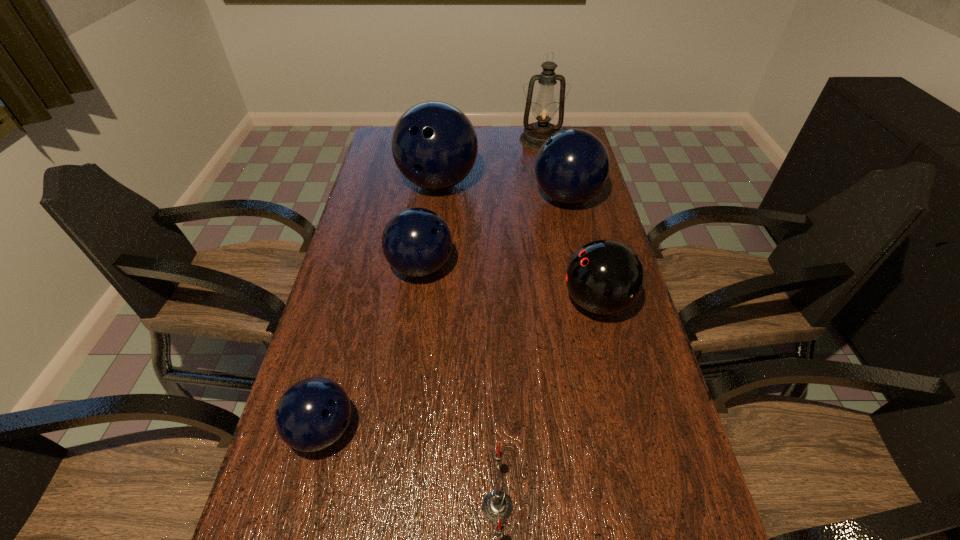
You are a GUI agent. You are given a task and a screenshot of the screen. Output one action in this format:
    pyautogui.click(x=<x>, y=<y>)
    Task: Click on the vacant space located on the surface of the sixth shortest object near the finger holes
    This screenshot has height=540, width=960.
    Given the screenshot: What is the action you would take?
    pyautogui.click(x=426, y=284)

What are the coordinates of `vacant point located 0.330m on the surface of the fifth shortest object near the finger holes` in the screenshot? It's located at (436, 198).

Identify the location of vacant space located 0.290m on the surface of the fifth shortest object near the finger holes. Image resolution: width=960 pixels, height=540 pixels. (x=447, y=198).

Image resolution: width=960 pixels, height=540 pixels. What are the coordinates of `free region located 0.060m on the surface of the fifth shortest object near the finger holes` in the screenshot? It's located at (515, 198).

Find the location of a particular element. The width and height of the screenshot is (960, 540). vacant space located on the surface of the third farthest blue bowling ball near the finger holes is located at coordinates (474, 267).

You are a GUI agent. You are given a task and a screenshot of the screen. Output one action in this format:
    pyautogui.click(x=<x>, y=<y>)
    Task: Click on the free space located on the surface of the black bowling ball near the finger holes
    This screenshot has width=960, height=540.
    Given the screenshot: What is the action you would take?
    pyautogui.click(x=536, y=302)

Identify the location of free space located 0.370m on the surface of the black bowling ball near the finger holes. (424, 302).

Where is `vacant point located 0.260m on the surface of the black bowling ball near the finger holes`? The height and width of the screenshot is (540, 960). vacant point located 0.260m on the surface of the black bowling ball near the finger holes is located at coordinates (465, 302).

Identify the location of vacant area situated on the surface of the shortest bowling ball near the finger holes. (385, 430).

Where is `object present at the far edge`? object present at the far edge is located at coordinates (544, 110).